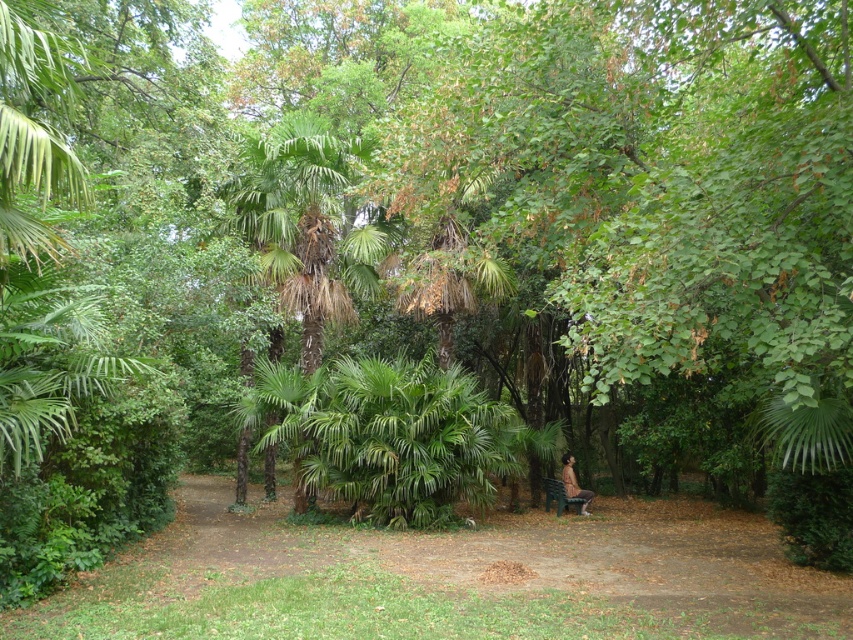
You are standing in the park and want to take a photo of the green leafy palm tree at center. If your camera has a maximum focus range of 12 meters, will you need to move closer to capture it clearly?

The green leafy palm tree at center is 13.48 meters away from the viewer. Since the camera can only focus up to 12 meters, you need to move closer to ensure the tree is within the camera range.

You are standing at the center of the park and see the green leafy palm tree at center and the brown textured jacket at center. If you want to pick up the jacket first before approaching the palm tree, which one should you walk towards first?

You should walk towards the brown textured jacket at center first because it is closer to you than the green leafy palm tree at center, which is 7.10 meters away.

You are a park visitor sitting on the green plastic bench at center. Looking up, you notice the green leafy palm tree at center. Is the palm tree above or below the bench?

The green leafy palm tree at center is above the green plastic bench at center.